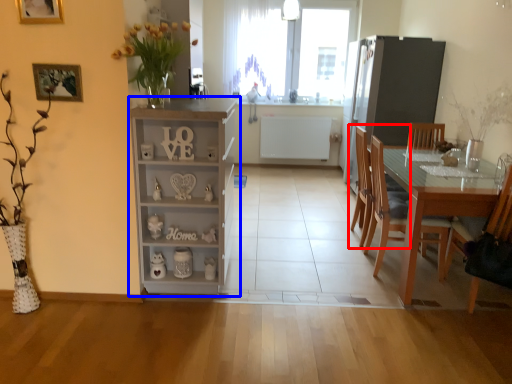
Question: Which object appears closest to the camera in this image, chair (highlighted by a red box) or cabinetry (highlighted by a blue box)?

Choices:
 (A) chair
 (B) cabinetry

Answer: (B)